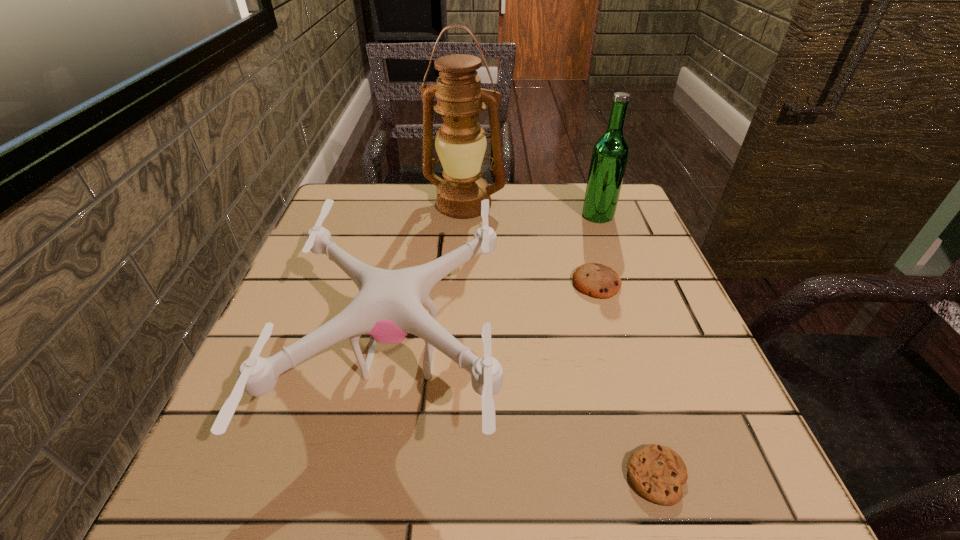
What are the coordinates of `the tallest object` in the screenshot? It's located at click(x=460, y=143).

Locate an element on the screen. Image resolution: width=960 pixels, height=540 pixels. the second tallest object is located at coordinates (610, 153).

You are a GUI agent. You are given a task and a screenshot of the screen. Output one action in this format:
    pyautogui.click(x=<x>, y=<y>)
    Task: Click on the drone
    
    Given the screenshot: What is the action you would take?
    pyautogui.click(x=389, y=306)

The width and height of the screenshot is (960, 540). Find the location of `the taller cookie`. the taller cookie is located at coordinates (596, 280).

Locate an element on the screen. The height and width of the screenshot is (540, 960). the second shortest object is located at coordinates (596, 280).

Locate an element on the screen. The height and width of the screenshot is (540, 960). the shorter cookie is located at coordinates (657, 472).

Locate an element on the screen. The width and height of the screenshot is (960, 540). the shortest object is located at coordinates (657, 472).

You are a GUI agent. You are given a task and a screenshot of the screen. Output one action in this format:
    pyautogui.click(x=<x>, y=<y>)
    Task: Click on the free space located on the left of the tallest object
    
    Given the screenshot: What is the action you would take?
    pyautogui.click(x=389, y=204)

Find the location of `vacant point located 0.370m on the left of the second tallest object`. vacant point located 0.370m on the left of the second tallest object is located at coordinates (431, 215).

At what (x,y) coordinates should I click in order to perform the action: click on vacant area located on the top of the third shortest object. Please return your answer as a coordinate pair (x, y). The height and width of the screenshot is (540, 960). Looking at the image, I should click on (597, 356).